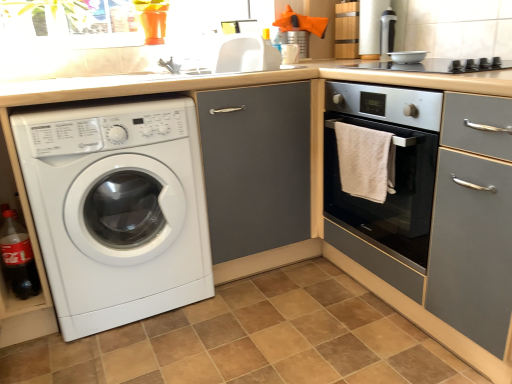
What is the approximate height of white glossy washing machine at lower left?

35.98 inches.

Measure the distance between metallic silver canister at upper right, the first appliance when ordered from back to front, and camera.

metallic silver canister at upper right, the first appliance when ordered from back to front, is 1.99 meters away from camera.

The height and width of the screenshot is (384, 512). Describe the element at coordinates (252, 340) in the screenshot. I see `brown tile at lower center` at that location.

What is the approximate height of silver metallic bowl at upper center, the second appliance when ordered from top to bottom?

1.76 inches.

Describe the element at coordinates (18, 257) in the screenshot. I see `translucent plastic bottle at lower left` at that location.

The height and width of the screenshot is (384, 512). I want to click on white textured towel at right, so click(x=365, y=161).

Locate an element on the screen. The image size is (512, 384). washing machine below the white textured towel at right (from the image's perspective) is located at coordinates (117, 209).

Is white glossy washing machine at lower left oriented away from white textured towel at right?

No, white textured towel at right is not at the back of white glossy washing machine at lower left.

What's the angular difference between white glossy washing machine at lower left and white textured towel at right's facing directions?

The facing directions of white glossy washing machine at lower left and white textured towel at right are 88 degrees apart.

From the picture: Would you say white glossy washing machine at lower left contains white textured towel at right?

No, white textured towel at right is located outside of white glossy washing machine at lower left.

From a real-world perspective, is translucent plastic bottle at lower left physically below brown tile at lower center?

Incorrect, from a real-world perspective, translucent plastic bottle at lower left is higher than brown tile at lower center.

Considering the relative sizes of translucent plastic bottle at lower left and brown tile at lower center in the image provided, is translucent plastic bottle at lower left taller than brown tile at lower center?

Correct, translucent plastic bottle at lower left is much taller as brown tile at lower center.

Is translucent plastic bottle at lower left next to brown tile at lower center?

No.

Does translucent plastic bottle at lower left come in front of brown tile at lower center?

No, translucent plastic bottle at lower left is further to the viewer.

From the image's perspective, relative to silver metallic bowl at upper center, the second appliance when ordered from top to bottom, is metallic silver canister at upper right, which appears as the 1th appliance when viewed from the top, above or below?

metallic silver canister at upper right, which appears as the 1th appliance when viewed from the top, is above silver metallic bowl at upper center, the second appliance when ordered from top to bottom.

Is metallic silver canister at upper right, which appears as the 1th appliance when viewed from the top, looking in the opposite direction of silver metallic bowl at upper center, which ranks as the first appliance in bottom-to-top order?

No, metallic silver canister at upper right, which appears as the 1th appliance when viewed from the top, is not facing the opposite direction of silver metallic bowl at upper center, which ranks as the first appliance in bottom-to-top order.

Is silver metallic bowl at upper center, acting as the 1th appliance starting from the front, a part of metallic silver canister at upper right, the first appliance when ordered from back to front?

No, metallic silver canister at upper right, the first appliance when ordered from back to front, does not contain silver metallic bowl at upper center, acting as the 1th appliance starting from the front.

In the scene shown: Which point is more distant from viewer, (385, 28) or (418, 58)?

The point (385, 28) is behind.

At what (x,y) coordinates should I click in order to perform the action: click on bottle on the left of white textured towel at right. Please return your answer as a coordinate pair (x, y). The width and height of the screenshot is (512, 384). Looking at the image, I should click on (18, 257).

Is translucent plastic bottle at lower left directly adjacent to white textured towel at right?

No, translucent plastic bottle at lower left is not next to white textured towel at right.

Who is taller, translucent plastic bottle at lower left or white textured towel at right?

Standing taller between the two is translucent plastic bottle at lower left.

From the image's perspective, which one is positioned lower, translucent plastic bottle at lower left or white textured towel at right?

translucent plastic bottle at lower left, from the image's perspective.

In the image, there is a white textured towel at right. At what (x,y) coordinates should I click in order to perform the action: click on cabinetry below it (from a real-world perspective). Please return your answer as a coordinate pair (x, y). Image resolution: width=512 pixels, height=384 pixels. Looking at the image, I should click on click(x=429, y=201).

In the image, is white textured towel at right positioned in front of or behind satin grey oven at center right?

In the image, white textured towel at right appears behind satin grey oven at center right.

From a real-world perspective, between white textured towel at right and satin grey oven at center right, who is vertically lower?

satin grey oven at center right, from a real-world perspective.

Which of these two, metallic silver canister at upper right, acting as the second appliance starting from the bottom, or white glossy washing machine at lower left, is thinner?

Thinner between the two is metallic silver canister at upper right, acting as the second appliance starting from the bottom.

Considering the positions of point (384, 35) and point (106, 225), is point (384, 35) closer or farther from the camera than point (106, 225)?

Point (384, 35).

From the image's perspective, is metallic silver canister at upper right, which appears as the 1th appliance when viewed from the top, under white glossy washing machine at lower left?

Actually, metallic silver canister at upper right, which appears as the 1th appliance when viewed from the top, appears above white glossy washing machine at lower left in the image.

Is metallic silver canister at upper right, acting as the second appliance starting from the bottom, directly adjacent to white glossy washing machine at lower left?

No, metallic silver canister at upper right, acting as the second appliance starting from the bottom, is not making contact with white glossy washing machine at lower left.

From a real-world perspective, between metallic silver canister at upper right, which appears as the 1th appliance when viewed from the top, and satin grey oven at center right, who is vertically lower?

satin grey oven at center right is physically lower.

Would you say metallic silver canister at upper right, which appears as the 1th appliance when viewed from the top, is outside satin grey oven at center right?

Indeed, metallic silver canister at upper right, which appears as the 1th appliance when viewed from the top, is completely outside satin grey oven at center right.

From the image's perspective, which is above, metallic silver canister at upper right, which appears as the 1th appliance when viewed from the top, or satin grey oven at center right?

metallic silver canister at upper right, which appears as the 1th appliance when viewed from the top, appears higher in the image.

The height and width of the screenshot is (384, 512). What are the coordinates of `bath towel above the white glossy washing machine at lower left (from a real-world perspective)` in the screenshot? It's located at (365, 161).

Find the location of a particular element. The image size is (512, 384). bottle behind the brown tile at lower center is located at coordinates (18, 257).

Which object lies further to the anchor point white glossy washing machine at lower left, matte gray cabinet at center or white textured towel at right?

white textured towel at right is further to white glossy washing machine at lower left.

When comparing their distances from brown tile at lower center, does white textured towel at right or silver metallic bowl at upper center, which ranks as the first appliance in bottom-to-top order, seem further?

silver metallic bowl at upper center, which ranks as the first appliance in bottom-to-top order, is positioned further to the anchor brown tile at lower center.

Based on their spatial positions, is white glossy sink at upper center or satin grey oven at center right closer to matte gray cabinet at center?

satin grey oven at center right is closer to matte gray cabinet at center.

Considering their positions, is matte gray cabinet at center positioned closer to translucent plastic bottle at lower left than metallic silver canister at upper right, acting as the second appliance starting from the bottom?

The object closer to translucent plastic bottle at lower left is matte gray cabinet at center.

Estimate the real-world distances between objects in this image. Which object is further from metallic silver canister at upper right, acting as the second appliance starting from the bottom, satin grey oven at center right or white glossy washing machine at lower left?

The object further to metallic silver canister at upper right, acting as the second appliance starting from the bottom, is white glossy washing machine at lower left.

Based on their spatial positions, is white glossy washing machine at lower left or metallic silver canister at upper right, the first appliance when ordered from back to front, closer to brown tile at lower center?

white glossy washing machine at lower left is closer to brown tile at lower center.

From the image, which object appears to be farther from white glossy sink at upper center, brown tile at lower center or translucent plastic bottle at lower left?

Among the two, brown tile at lower center is located further to white glossy sink at upper center.

From the picture: When comparing their distances from translucent plastic bottle at lower left, does white glossy sink at upper center or satin grey oven at center right seem closer?

white glossy sink at upper center is positioned closer to the anchor translucent plastic bottle at lower left.

Identify the location of bath towel situated between white glossy sink at upper center and silver metallic bowl at upper center, acting as the 1th appliance starting from the front, from left to right. (365, 161).

What are the coordinates of `washing machine situated between translucent plastic bottle at lower left and matte gray cabinet at center from left to right` in the screenshot? It's located at (117, 209).

Where is `washing machine between brown tile at lower center and matte gray cabinet at center along the z-axis`? This screenshot has width=512, height=384. washing machine between brown tile at lower center and matte gray cabinet at center along the z-axis is located at coordinates (117, 209).

Image resolution: width=512 pixels, height=384 pixels. Find the location of `screen door that lies between white glossy sink at upper center and brown tile at lower center from top to bottom`. screen door that lies between white glossy sink at upper center and brown tile at lower center from top to bottom is located at coordinates (256, 167).